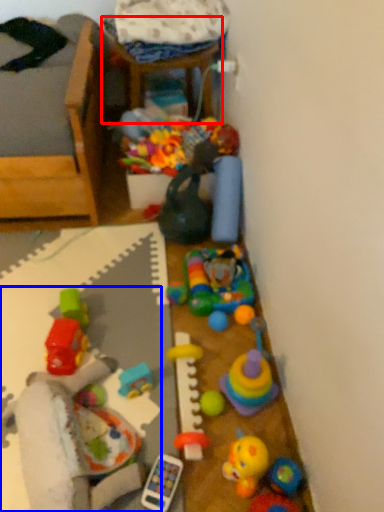
Question: Which object appears closest to the camera in this image, furniture (highlighted by a red box) or toy (highlighted by a blue box)?

Choices:
 (A) furniture
 (B) toy

Answer: (B)